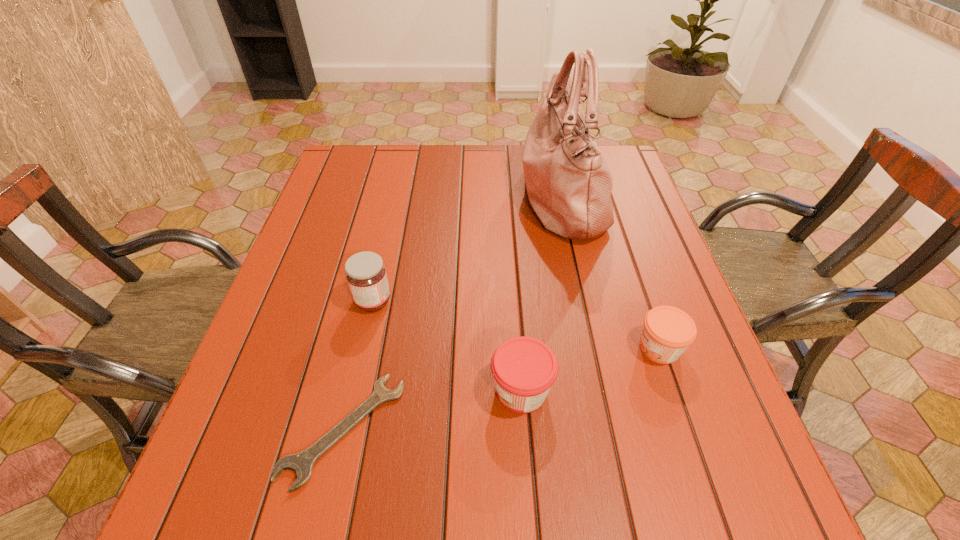
Locate an element on the screen. The width and height of the screenshot is (960, 540). vacant space positioned 0.370m at the front of the handbag with handles is located at coordinates (390, 197).

The height and width of the screenshot is (540, 960). I want to click on blank space located at the front of the handbag with handles, so coord(488,197).

Find the location of a particular element. blank space located 0.160m on the back of the tallest jam is located at coordinates (387, 241).

At what (x,y) coordinates should I click in order to perform the action: click on vacant space located on the label side of the second shortest jam. Please return your answer as a coordinate pair (x, y). This screenshot has height=540, width=960. Looking at the image, I should click on (336, 390).

Identify the location of blank space located on the label side of the second shortest jam. (309, 390).

Image resolution: width=960 pixels, height=540 pixels. What are the coordinates of `vacant space located on the label side of the second shortest jam` in the screenshot? It's located at (383, 390).

The image size is (960, 540). Find the location of `free location located 0.150m on the front label of the second shortest object`. free location located 0.150m on the front label of the second shortest object is located at coordinates (562, 348).

Locate an element on the screen. This screenshot has height=540, width=960. blank space located on the front label of the second shortest object is located at coordinates (517, 348).

Locate an element on the screen. This screenshot has width=960, height=540. vacant space located on the front label of the second shortest object is located at coordinates (453, 348).

Locate an element on the screen. This screenshot has height=540, width=960. free space located on the front of the shortest object is located at coordinates (320, 536).